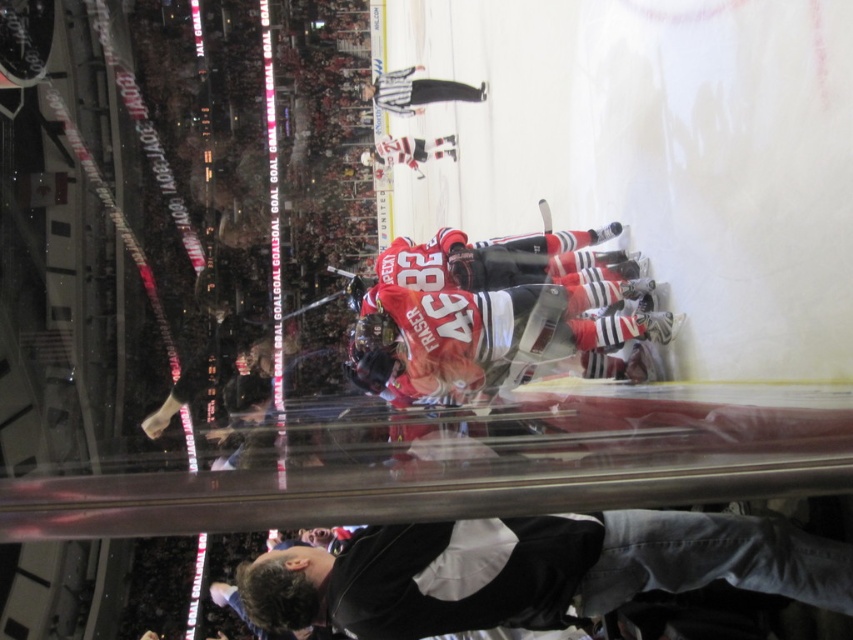
Between dark gray jacket at lower center and black uniform at upper center, which one has more height?

With more height is black uniform at upper center.

Does dark gray jacket at lower center have a lesser width compared to black uniform at upper center?

In fact, dark gray jacket at lower center might be wider than black uniform at upper center.

Between point (383, 600) and point (404, 97), which one is positioned in front?

Point (383, 600) is in front.

You are a GUI agent. You are given a task and a screenshot of the screen. Output one action in this format:
    pyautogui.click(x=<x>, y=<y>)
    Task: Click on the dark gray jacket at lower center
    
    Given the screenshot: What is the action you would take?
    534,570

Which is behind, point (650, 529) or point (614, 282)?

Point (614, 282)

Is point (595, 534) positioned after point (575, 324)?

No, (595, 534) is closer to viewer.

The height and width of the screenshot is (640, 853). I want to click on dark gray jacket at lower center, so click(534, 570).

What do you see at coordinates (486, 333) in the screenshot? I see `matte red jersey at center` at bounding box center [486, 333].

Between matte red jersey at center and black uniform at upper center, which one appears on the right side from the viewer's perspective?

Positioned to the right is matte red jersey at center.

The image size is (853, 640). In order to click on matte red jersey at center in this screenshot , I will do `click(486, 333)`.

Locate an element on the screen. The image size is (853, 640). matte red jersey at center is located at coordinates (486, 333).